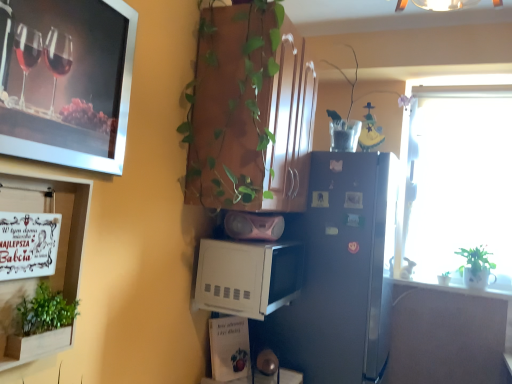
Question: From a real-world perspective, is green leafy plant at lower left, the first houseplant viewed from the left, located higher than translucent plastic vase at upper center, the second houseplant positioned from the back?

Choices:
 (A) yes
 (B) no

Answer: (B)

Question: Is green leafy plant at lower left, the second houseplant when ordered from bottom to top, with translucent plastic vase at upper center, the second houseplant positioned from the back?

Choices:
 (A) yes
 (B) no

Answer: (B)

Question: Is green leafy plant at lower left, the first houseplant viewed from the left, thinner than translucent plastic vase at upper center, the second houseplant positioned from the back?

Choices:
 (A) yes
 (B) no

Answer: (A)

Question: Is green leafy plant at lower left, the first houseplant viewed from the left, to the right of translucent plastic vase at upper center, the second houseplant positioned from the back, from the viewer's perspective?

Choices:
 (A) yes
 (B) no

Answer: (B)

Question: From a real-world perspective, does green leafy plant at lower left, the first houseplant viewed from the left, sit lower than translucent plastic vase at upper center, the second houseplant positioned from the back?

Choices:
 (A) yes
 (B) no

Answer: (A)

Question: Can you confirm if green leafy plant at lower left, the first houseplant viewed from the left, is shorter than translucent plastic vase at upper center, the second houseplant positioned from the back?

Choices:
 (A) no
 (B) yes

Answer: (B)

Question: Is green matte plant at right, the 3th houseplant viewed from the top, closer to camera compared to pink matte speaker at center, positioned as the 2th appliance in bottom-to-top order?

Choices:
 (A) yes
 (B) no

Answer: (B)

Question: Is green matte plant at right, marked as the first houseplant in a back-to-front arrangement, facing away from pink matte speaker at center, placed as the 1th appliance when sorted from top to bottom?

Choices:
 (A) yes
 (B) no

Answer: (B)

Question: Does green matte plant at right, which is counted as the first houseplant, starting from the right, have a greater height compared to pink matte speaker at center, positioned as the 2th appliance in bottom-to-top order?

Choices:
 (A) no
 (B) yes

Answer: (B)

Question: From a real-world perspective, is green matte plant at right, which is counted as the first houseplant, starting from the right, under pink matte speaker at center, placed as the 1th appliance when sorted from top to bottom?

Choices:
 (A) no
 (B) yes

Answer: (B)

Question: Is green matte plant at right, arranged as the 1th houseplant when ordered from the bottom, at the right side of pink matte speaker at center, placed as the 1th appliance when sorted from top to bottom?

Choices:
 (A) yes
 (B) no

Answer: (A)

Question: Does green matte plant at right, which is counted as the first houseplant, starting from the right, turn towards pink matte speaker at center, placed as the 1th appliance when sorted from top to bottom?

Choices:
 (A) yes
 (B) no

Answer: (B)

Question: Considering the relative positions of translucent plastic vase at upper center, the second houseplant viewed from the left, and green leafy plant at lower left, marked as the third houseplant in a right-to-left arrangement, in the image provided, is translucent plastic vase at upper center, the second houseplant viewed from the left, behind green leafy plant at lower left, marked as the third houseplant in a right-to-left arrangement,?

Choices:
 (A) no
 (B) yes

Answer: (B)